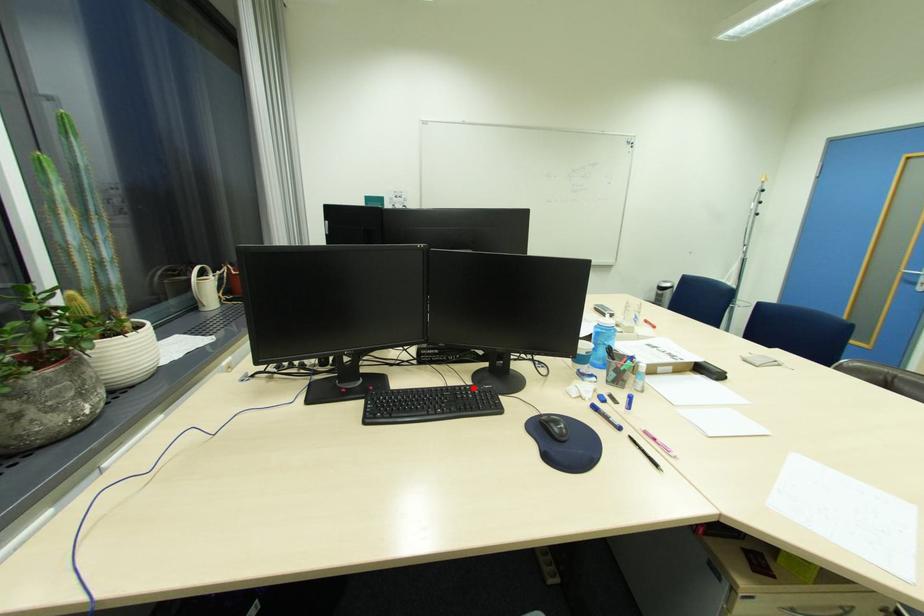
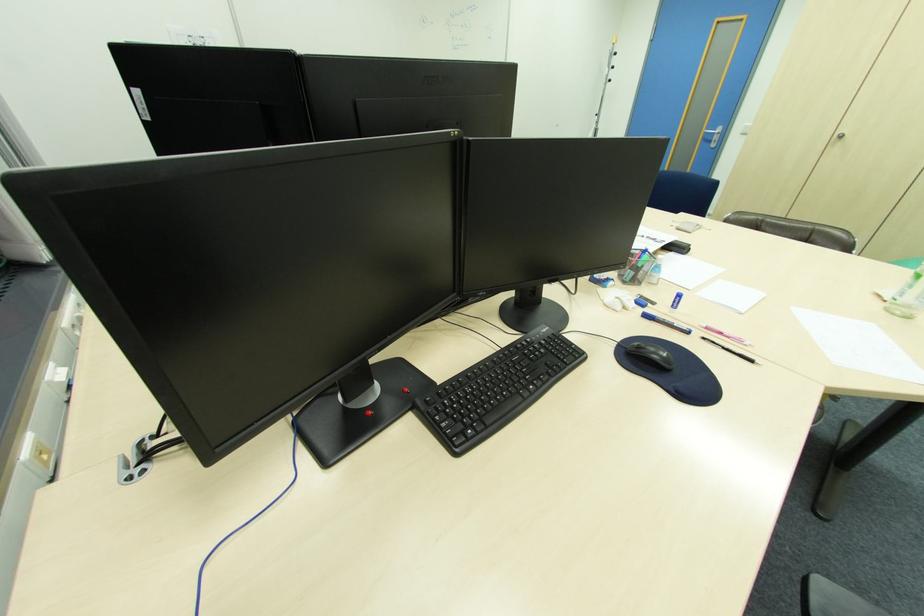
In the second image, find the point that corresponds to the highlighted location in the first image.

(533, 339)